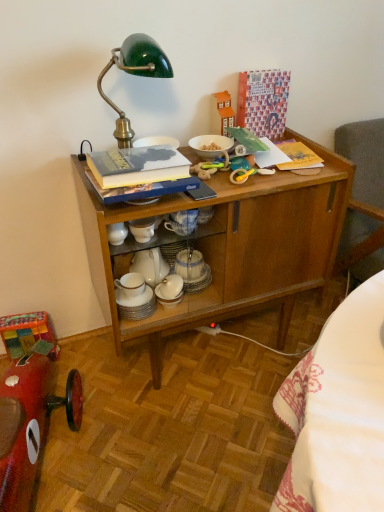
Where is `empty space that is in between wooden cabinet at center and shiny red toy car at lower left`? empty space that is in between wooden cabinet at center and shiny red toy car at lower left is located at coordinates (174, 423).